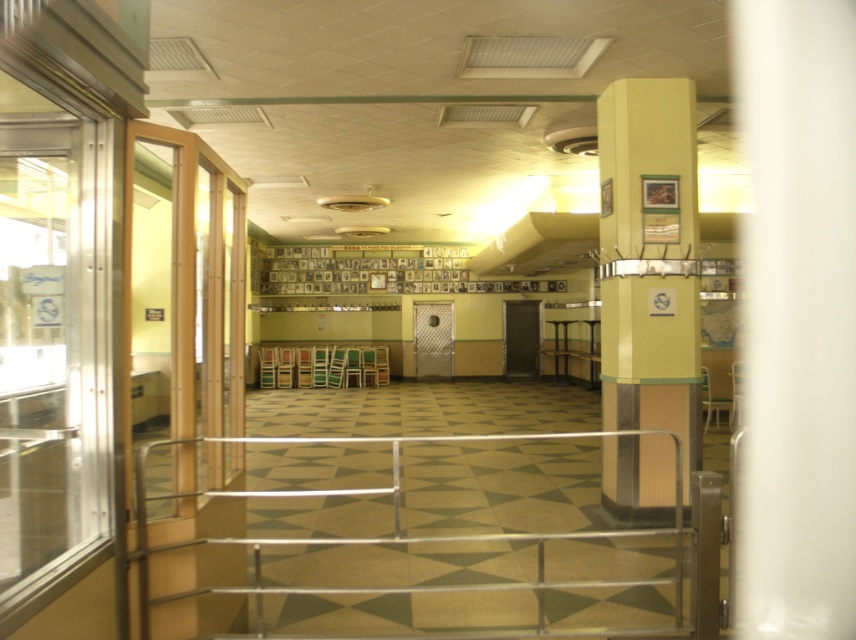
Is point (542, 545) farther from viewer compared to point (666, 497)?

That is False.

What do you see at coordinates (473, 550) in the screenshot? This screenshot has width=856, height=640. I see `silver metallic rail at center` at bounding box center [473, 550].

The height and width of the screenshot is (640, 856). I want to click on silver metallic rail at center, so click(473, 550).